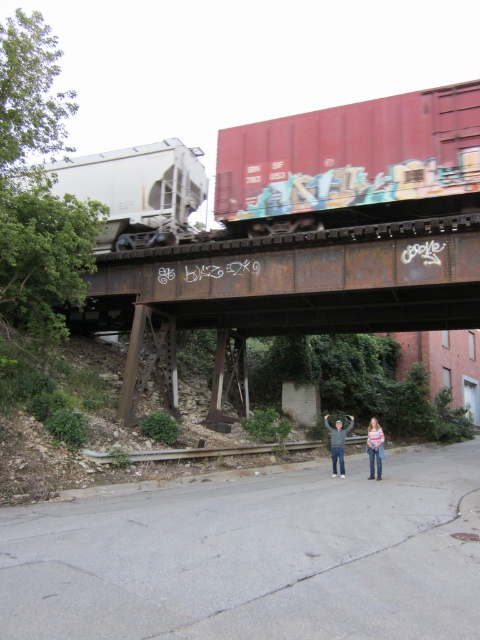
Question: Is white matte freight car at left in front of striped sweater at center?

Choices:
 (A) yes
 (B) no

Answer: (B)

Question: Which point is farther to the camera?

Choices:
 (A) (333, 461)
 (B) (333, 435)

Answer: (A)

Question: Which point is farther from the camera taking this photo?

Choices:
 (A) (352, 204)
 (B) (149, 170)

Answer: (B)

Question: Considering the relative positions of red matte freight car at upper center and white matte freight car at left in the image provided, where is red matte freight car at upper center located with respect to white matte freight car at left?

Choices:
 (A) right
 (B) left

Answer: (A)

Question: Which object is the closest to the white matte freight car at left?

Choices:
 (A) striped sweater at center
 (B) red matte freight car at upper center
 (C) rusty metal train bridge at center
 (D) denim jeans at center

Answer: (C)

Question: Is white matte freight car at left above gray fleece jacket at center?

Choices:
 (A) yes
 (B) no

Answer: (A)